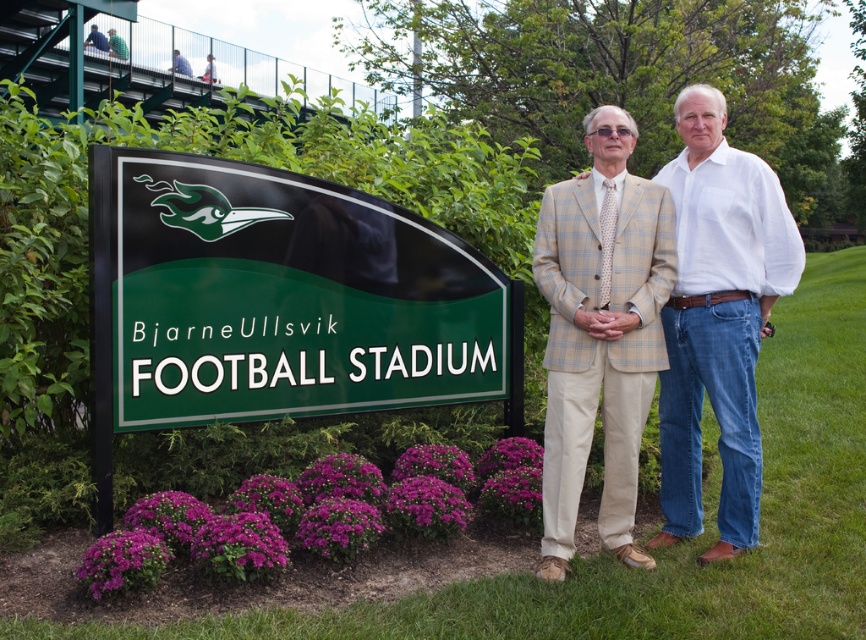
Question: Can you confirm if green glossy sign at lower left is smaller than blue shirt at upper left?

Choices:
 (A) yes
 (B) no

Answer: (B)

Question: From the image, what is the correct spatial relationship of green glossy sign at lower left in relation to blue shirt at upper left?

Choices:
 (A) below
 (B) above

Answer: (A)

Question: Estimate the real-world distances between objects in this image. Which object is closer to the green glossy sign at lower left?

Choices:
 (A) blue shirt at upper left
 (B) beige plaid blazer at center

Answer: (B)

Question: Which object is positioned farthest from the blue shirt at upper left?

Choices:
 (A) beige plaid blazer at center
 (B) green glossy sign at lower left

Answer: (A)

Question: Based on their relative distances, which object is nearer to the green glossy sign at lower left?

Choices:
 (A) beige plaid blazer at center
 (B) blue shirt at upper left

Answer: (A)

Question: Is green glossy sign at lower left above beige plaid blazer at center?

Choices:
 (A) no
 (B) yes

Answer: (B)